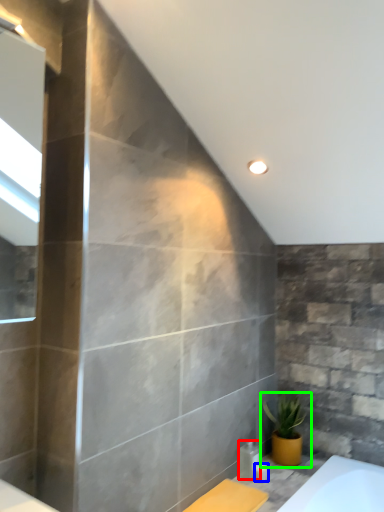
Question: Estimate the real-world distances between objects in this image. Which object is closer to toiletry (highlighted by a red box), toiletry (highlighted by a blue box) or houseplant (highlighted by a green box)?

Choices:
 (A) toiletry
 (B) houseplant

Answer: (A)